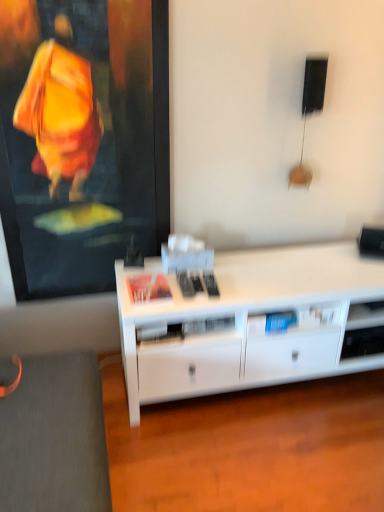
Question: Based on their positions, is white matte desk at center located to the left or right of textured fabric cushion at lower left?

Choices:
 (A) right
 (B) left

Answer: (A)

Question: Is white matte desk at center inside or outside of textured fabric cushion at lower left?

Choices:
 (A) inside
 (B) outside

Answer: (B)

Question: Based on their sizes in the image, would you say white matte desk at center is bigger or smaller than textured fabric cushion at lower left?

Choices:
 (A) small
 (B) big

Answer: (B)

Question: From the image's perspective, relative to white matte desk at center, is textured fabric cushion at lower left above or below?

Choices:
 (A) above
 (B) below

Answer: (B)

Question: Is textured fabric cushion at lower left inside the boundaries of white matte desk at center, or outside?

Choices:
 (A) inside
 (B) outside

Answer: (B)

Question: Is textured fabric cushion at lower left bigger or smaller than white matte desk at center?

Choices:
 (A) big
 (B) small

Answer: (B)

Question: Is textured fabric cushion at lower left in front of or behind white matte desk at center in the image?

Choices:
 (A) front
 (B) behind

Answer: (A)